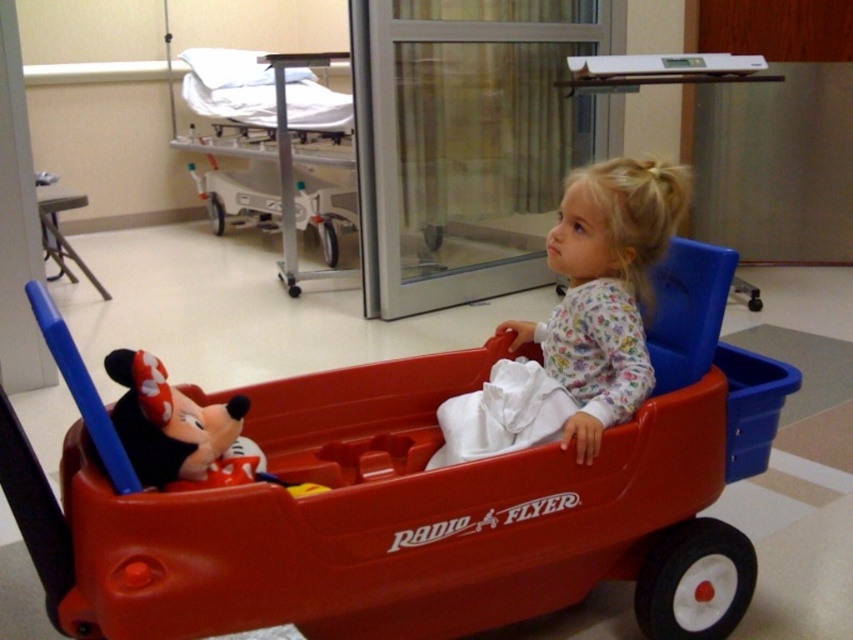
You are a nurse in a hospital. You need to move the matte plush mickey mouse at lower left to the white fabric hospital bed at upper center. Can you do this without moving the child in the wagon?

The white fabric hospital bed at upper center is located above the matte plush mickey mouse at lower left, so yes, the nurse can move the matte plush mickey mouse at lower left to the white fabric hospital bed at upper center without moving the child in the wagon since the bed is positioned above the toy.

Based on the scene, where is the matte plastic wagon at center located relative to the matte plush mickey mouse at lower left?

The matte plastic wagon at center is to the right of the matte plush mickey mouse at lower left.